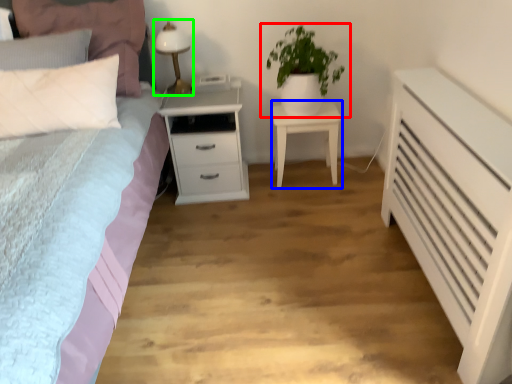
Question: Estimate the real-world distances between objects in this image. Which object is closer to houseplant (highlighted by a red box), nightstand (highlighted by a blue box) or bedside lamp (highlighted by a green box)?

Choices:
 (A) nightstand
 (B) bedside lamp

Answer: (A)